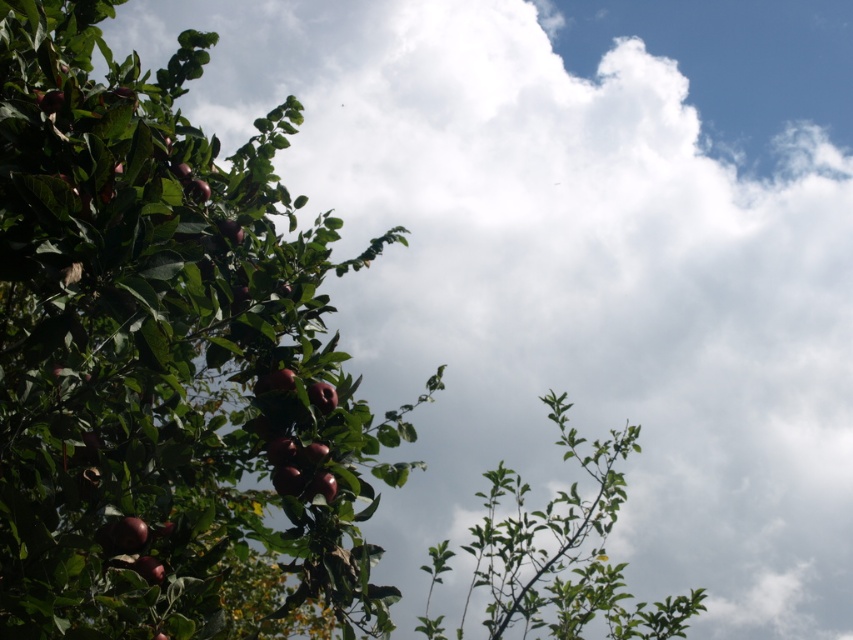
Question: In this image, where is glossy red apples at left located relative to green leafy branch at center?

Choices:
 (A) above
 (B) below

Answer: (A)

Question: Is glossy red apples at left behind green leafy branch at center?

Choices:
 (A) no
 (B) yes

Answer: (A)

Question: Can you confirm if glossy red apples at left is wider than green leafy branch at center?

Choices:
 (A) yes
 (B) no

Answer: (A)

Question: Which of the following is the farthest from the observer?

Choices:
 (A) (36, 260)
 (B) (572, 492)

Answer: (B)